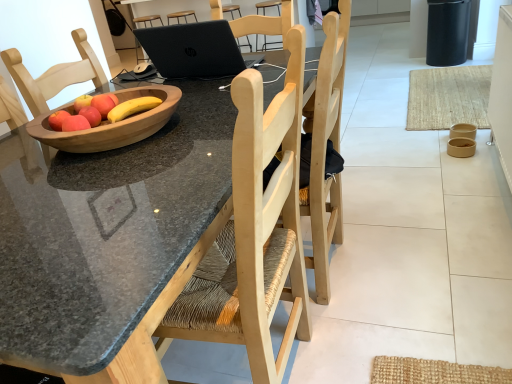
Where is `matte brown bowl at right, the third bowl from the front`? Image resolution: width=512 pixels, height=384 pixels. matte brown bowl at right, the third bowl from the front is located at coordinates (463, 131).

Image resolution: width=512 pixels, height=384 pixels. Describe the element at coordinates (91, 115) in the screenshot. I see `matte wood apple at center, the 1th apple when ordered from front to back` at that location.

Locate an element on the screen. This screenshot has width=512, height=384. matte wood apple at center, which is the 1th apple in bottom-to-top order is located at coordinates (91, 115).

Describe the element at coordinates (447, 32) in the screenshot. This screenshot has width=512, height=384. I see `black matte trash bin/can at upper right` at that location.

What do you see at coordinates (195, 50) in the screenshot?
I see `black matte laptop at upper center` at bounding box center [195, 50].

Where is `wooden bowl of fruit at center`? wooden bowl of fruit at center is located at coordinates (101, 112).

What do you see at coordinates (101, 112) in the screenshot? This screenshot has width=512, height=384. I see `wooden bowl of fruit at center` at bounding box center [101, 112].

This screenshot has width=512, height=384. In order to click on brown paper bowl at lower right, which is the second bowl from front to back in this screenshot , I will do `click(461, 147)`.

From a real-world perspective, is matte wooden apple at center, positioned as the second apple in bottom-to-top order, above or below black matte trash bin/can at upper right?

From a real-world perspective, matte wooden apple at center, positioned as the second apple in bottom-to-top order, is physically above black matte trash bin/can at upper right.

From the image's perspective, between matte wooden apple at center, positioned as the second apple in bottom-to-top order, and black matte trash bin/can at upper right, which one is located above?

black matte trash bin/can at upper right.

Considering the sizes of matte wooden apple at center, positioned as the second apple in bottom-to-top order, and black matte trash bin/can at upper right in the image, is matte wooden apple at center, positioned as the second apple in bottom-to-top order, wider or thinner than black matte trash bin/can at upper right?

In the image, matte wooden apple at center, positioned as the second apple in bottom-to-top order, appears to be more narrow than black matte trash bin/can at upper right.

In the scene shown: Can you tell me how much black matte laptop at upper center and wooden bowl of fruit at center differ in facing direction?

black matte laptop at upper center and wooden bowl of fruit at center are facing 26 degrees away from each other.

Is black matte laptop at upper center turned away from wooden bowl of fruit at center?

Yes, wooden bowl of fruit at center is at the back of black matte laptop at upper center.

Between black matte laptop at upper center and wooden bowl of fruit at center, which one has more height?

black matte laptop at upper center.

Are black matte laptop at upper center and wooden bowl of fruit at center far apart?

No, there isn't a large distance between black matte laptop at upper center and wooden bowl of fruit at center.

Is the depth of matte wooden apple at center, the 1th apple in the top-to-bottom sequence, less than that of granite table at center?

No, the depth of matte wooden apple at center, the 1th apple in the top-to-bottom sequence, is greater than that of granite table at center.

Image resolution: width=512 pixels, height=384 pixels. In the image, there is a matte wooden apple at center, the 1th apple in the top-to-bottom sequence. In order to click on desk below it (from a real-world perspective) in this screenshot , I will do click(x=105, y=232).

Consider the image. Could you measure the distance between matte wooden apple at center, the 1th apple in the top-to-bottom sequence, and granite table at center?

14.59 inches.

Considering the positions of point (98, 110) and point (75, 172), is point (98, 110) closer or farther from the camera than point (75, 172)?

Point (98, 110) appears to be farther away from the viewer than point (75, 172).

Is wooden bowl at left, which is the first bowl in left-to-right order, next to wooden bowl of fruit at center and touching it?

Yes, wooden bowl at left, which is the first bowl in left-to-right order, is beside wooden bowl of fruit at center.

How far apart are wooden bowl at left, the 3th bowl from the back, and wooden bowl of fruit at center?

wooden bowl at left, the 3th bowl from the back, and wooden bowl of fruit at center are 2.10 inches apart.

Is the depth of wooden bowl at left, which is the third bowl from right to left, less than that of wooden bowl of fruit at center?

Yes, the depth of wooden bowl at left, which is the third bowl from right to left, is less than that of wooden bowl of fruit at center.

In terms of height, does wooden bowl at left, which is the third bowl from right to left, look taller or shorter compared to wooden bowl of fruit at center?

Clearly, wooden bowl at left, which is the third bowl from right to left, is taller compared to wooden bowl of fruit at center.

In terms of height, does black matte laptop at upper center look taller or shorter compared to brown paper bowl at lower right, which is the second bowl from front to back?

In the image, black matte laptop at upper center appears to be taller than brown paper bowl at lower right, which is the second bowl from front to back.

Measure the distance between black matte laptop at upper center and brown paper bowl at lower right, which ranks as the 2th bowl in back-to-front order.

1.57 meters.

From a real-world perspective, is black matte laptop at upper center physically above brown paper bowl at lower right, which is the second bowl from left to right?

Yes.

Is point (204, 45) positioned behind point (470, 155)?

No, (204, 45) is closer to viewer.

Considering the relative sizes of matte wood apple at center, which is the second apple in top-to-bottom order, and matte brown bowl at right, the third bowl from the front, in the image provided, is matte wood apple at center, which is the second apple in top-to-bottom order, bigger than matte brown bowl at right, the third bowl from the front,?

Actually, matte wood apple at center, which is the second apple in top-to-bottom order, might be smaller than matte brown bowl at right, the third bowl from the front.

Choose the correct answer: Is matte wood apple at center, which is the 1th apple in bottom-to-top order, inside matte brown bowl at right, which is counted as the third bowl, starting from the left, or outside it?

matte wood apple at center, which is the 1th apple in bottom-to-top order, is not inside matte brown bowl at right, which is counted as the third bowl, starting from the left, it's outside.

Which is closer, (94, 108) or (457, 133)?

Point (94, 108)

Is matte wood apple at center, the 1th apple when ordered from front to back, facing away from matte brown bowl at right, the third bowl from the front?

matte wood apple at center, the 1th apple when ordered from front to back, does not have its back to matte brown bowl at right, the third bowl from the front.

Is wooden bowl of fruit at center oriented towards brown paper bowl at lower right, which is the second bowl from left to right?

No, wooden bowl of fruit at center is not turned towards brown paper bowl at lower right, which is the second bowl from left to right.

Between wooden bowl of fruit at center and brown paper bowl at lower right, which ranks as the second bowl in right-to-left order, which one has larger width?

With larger width is wooden bowl of fruit at center.

In the scene shown: From the image's perspective, is wooden bowl of fruit at center on top of brown paper bowl at lower right, which ranks as the second bowl in right-to-left order?

No, from the image's perspective, wooden bowl of fruit at center is not on top of brown paper bowl at lower right, which ranks as the second bowl in right-to-left order.

The image size is (512, 384). I want to click on trash bin/can lying above the matte wooden apple at center, the 2th apple from the front (from the image's perspective), so click(447, 32).

Locate an element on the screen. laptop lying behind the wooden bowl of fruit at center is located at coordinates (195, 50).

When comparing their distances from brown paper bowl at lower right, which is the second bowl from left to right, does wooden bowl of fruit at center or matte wood apple at center, which is the second apple in top-to-bottom order, seem closer?

wooden bowl of fruit at center.

From the image, which object appears to be farther from matte brown bowl at right, the third bowl from the front, granite table at center or matte wood apple at center, the 2th apple positioned from the back?

Among the two, matte wood apple at center, the 2th apple positioned from the back, is located further to matte brown bowl at right, the third bowl from the front.

Based on their spatial positions, is granite table at center or black matte laptop at upper center closer to brown paper bowl at lower right, which is the second bowl from left to right?

black matte laptop at upper center is closer to brown paper bowl at lower right, which is the second bowl from left to right.

Consider the image. Estimate the real-world distances between objects in this image. Which object is closer to wooden bowl of fruit at center, matte wooden apple at center, positioned as the second apple in bottom-to-top order, or black matte laptop at upper center?

matte wooden apple at center, positioned as the second apple in bottom-to-top order.

From the image, which object appears to be nearer to wooden bowl of fruit at center, matte wood apple at center, the 2th apple positioned from the back, or granite table at center?

matte wood apple at center, the 2th apple positioned from the back, is positioned closer to the anchor wooden bowl of fruit at center.

When comparing their distances from black matte trash bin/can at upper right, does wooden bowl at left, marked as the 1th bowl in a front-to-back arrangement, or wooden bowl of fruit at center seem closer?

Among the two, wooden bowl at left, marked as the 1th bowl in a front-to-back arrangement, is located nearer to black matte trash bin/can at upper right.

When comparing their distances from brown paper bowl at lower right, which ranks as the second bowl in right-to-left order, does matte wood apple at center, which is the 1th apple in bottom-to-top order, or wooden bowl of fruit at center seem further?

Among the two, matte wood apple at center, which is the 1th apple in bottom-to-top order, is located further to brown paper bowl at lower right, which ranks as the second bowl in right-to-left order.

Consider the image. When comparing their distances from brown paper bowl at lower right, which is the second bowl from left to right, does granite table at center or matte brown bowl at right, the third bowl from the front, seem closer?

matte brown bowl at right, the third bowl from the front, is closer to brown paper bowl at lower right, which is the second bowl from left to right.

Where is `fruit between granite table at center and brown paper bowl at lower right, which ranks as the 2th bowl in back-to-front order, along the z-axis`? This screenshot has height=384, width=512. fruit between granite table at center and brown paper bowl at lower right, which ranks as the 2th bowl in back-to-front order, along the z-axis is located at coordinates (101, 112).

Locate an element on the screen. The height and width of the screenshot is (384, 512). laptop between wooden bowl of fruit at center and brown paper bowl at lower right, which ranks as the second bowl in right-to-left order, from left to right is located at coordinates (195, 50).

Where is `bowl between granite table at center and black matte laptop at upper center in the front-back direction`? This screenshot has height=384, width=512. bowl between granite table at center and black matte laptop at upper center in the front-back direction is located at coordinates 111,124.

The height and width of the screenshot is (384, 512). Find the location of `apple between wooden bowl at left, which is the third bowl from right to left, and matte wooden apple at center, the first apple from the back, along the z-axis`. apple between wooden bowl at left, which is the third bowl from right to left, and matte wooden apple at center, the first apple from the back, along the z-axis is located at coordinates pyautogui.click(x=91, y=115).